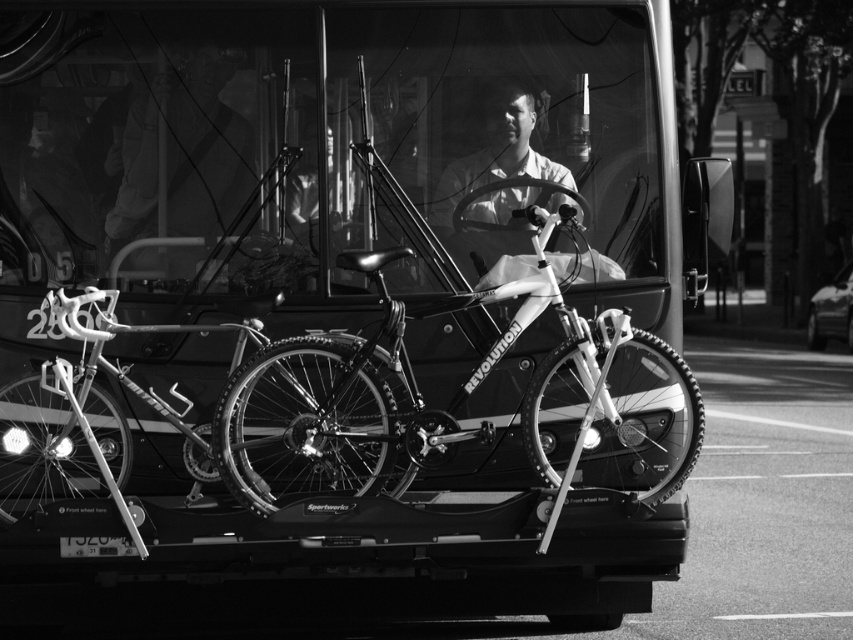
Question: Which object is closer to the camera taking this photo?

Choices:
 (A) shiny silver bicycle at center
 (B) metallic silver bicycle at center
 (C) shiny metallic bicycle at center

Answer: (A)

Question: Among these points, which one is nearest to the camera?

Choices:
 (A) (349, 252)
 (B) (521, 193)
 (C) (258, 134)
 (D) (378, 352)

Answer: (D)

Question: Does metallic silver bicycle at center have a greater width compared to shiny silver bicycle at center?

Choices:
 (A) yes
 (B) no

Answer: (A)

Question: Estimate the real-world distances between objects in this image. Which object is closer to the smooth white shirt at center?

Choices:
 (A) shiny metallic bicycle at center
 (B) metallic silver bicycle at center
 (C) shiny silver bicycle at center

Answer: (B)

Question: Considering the relative positions of metallic silver bicycle at center and shiny metallic bicycle at center in the image provided, where is metallic silver bicycle at center located with respect to shiny metallic bicycle at center?

Choices:
 (A) above
 (B) below

Answer: (A)

Question: Observing the image, what is the correct spatial positioning of shiny metallic bicycle at center in reference to shiny silver bicycle at center?

Choices:
 (A) right
 (B) left

Answer: (A)